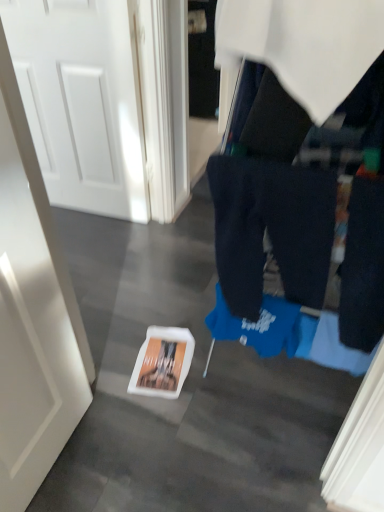
The width and height of the screenshot is (384, 512). What are the coordinates of `vacant location below white glossy door at upper left, which is the 1th door in back-to-front order (from a real-world perspective)` in the screenshot? It's located at (91, 211).